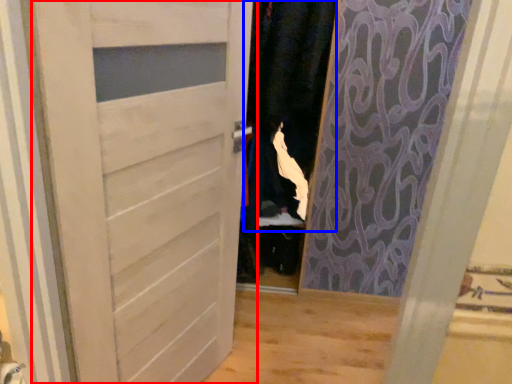
Question: Which of the following is the farthest to the observer, door (highlighted by a red box) or clothing (highlighted by a blue box)?

Choices:
 (A) door
 (B) clothing

Answer: (B)